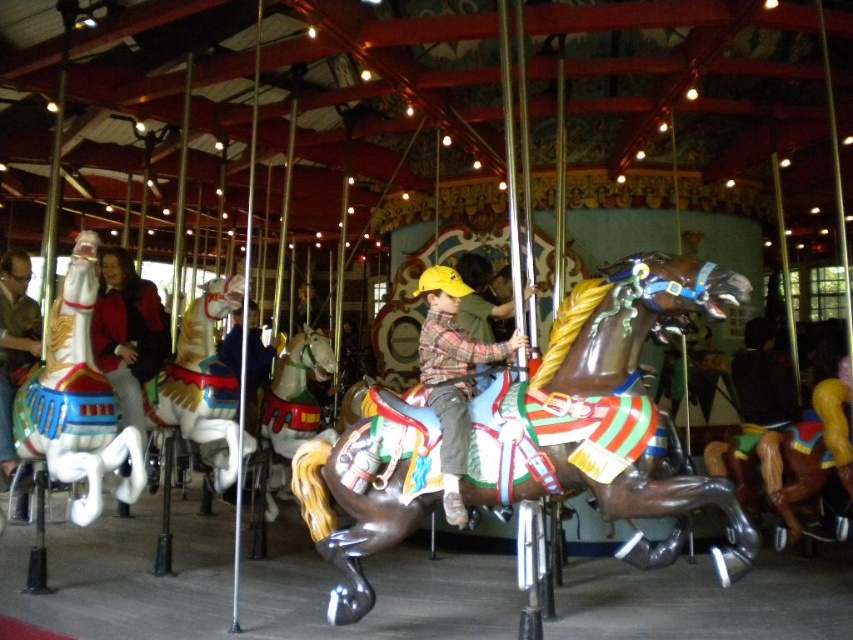
From the picture: Is matte black jacket at left to the left of brushed metal water at bottle left from the viewer's perspective?

In fact, matte black jacket at left is to the right of brushed metal water at bottle left.

At what (x,y) coordinates should I click in order to perform the action: click on matte black jacket at left. Please return your answer as a coordinate pair (x, y). The width and height of the screenshot is (853, 640). Looking at the image, I should click on (126, 333).

Locate an element on the screen. matte black jacket at left is located at coordinates (126, 333).

Does shiny gold horse at center have a greater height compared to matte black jacket at left?

Yes, shiny gold horse at center is taller than matte black jacket at left.

Locate an element on the screen. shiny gold horse at center is located at coordinates (202, 385).

Locate an element on the screen. The height and width of the screenshot is (640, 853). shiny gold horse at center is located at coordinates (202, 385).

How much distance is there between shiny brown horse at center and shiny gold horse at center?

The distance of shiny brown horse at center from shiny gold horse at center is 1.44 meters.

Can you confirm if shiny brown horse at center is positioned to the left of shiny gold horse at center?

Incorrect, shiny brown horse at center is not on the left side of shiny gold horse at center.

Who is more forward, (677,541) or (184,426)?

Point (677,541) is more forward.

Find the location of `shiny brown horse at center`. shiny brown horse at center is located at coordinates (605, 406).